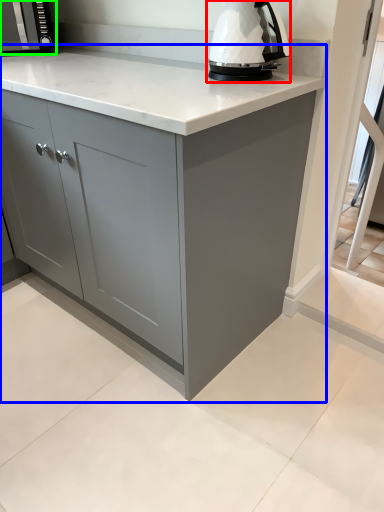
Question: Estimate the real-world distances between objects in this image. Which object is closer to home appliance (highlighted by a red box), cabinetry (highlighted by a blue box) or kitchen appliance (highlighted by a green box)?

Choices:
 (A) cabinetry
 (B) kitchen appliance

Answer: (A)